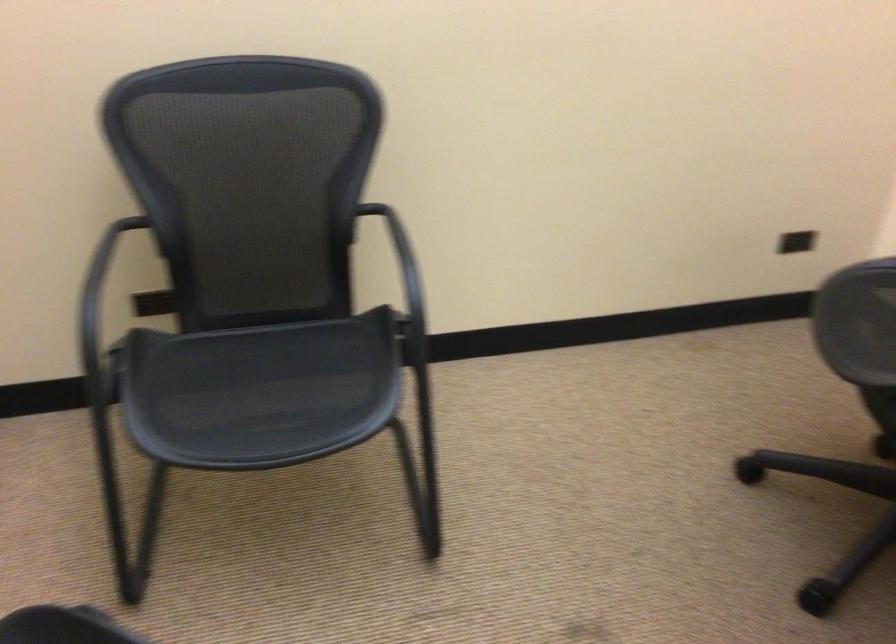
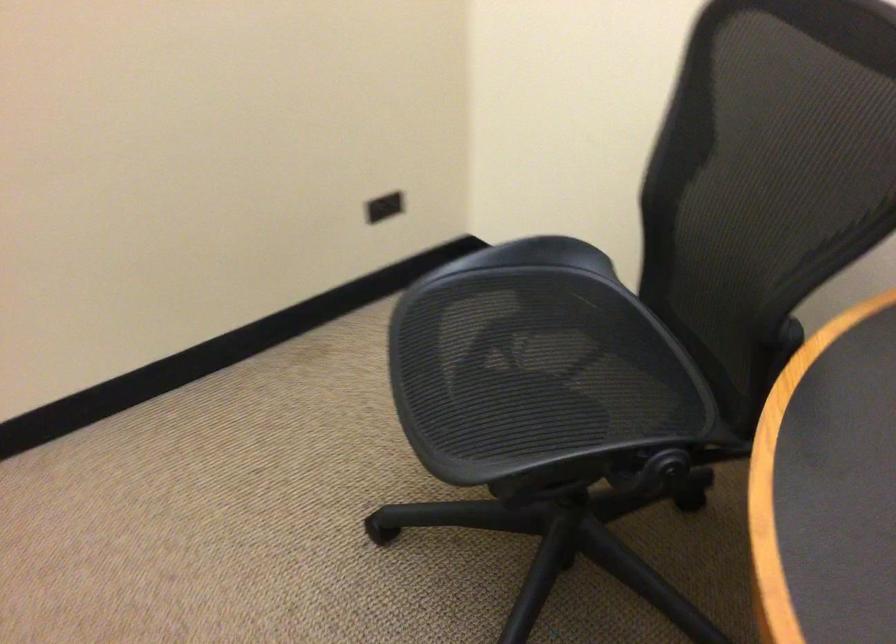
Question: The images are taken continuously from a first-person perspective. In which direction is your viewpoint rotating?

Choices:
 (A) Left
 (B) Right
 (C) Up
 (D) Down

Answer: (B)